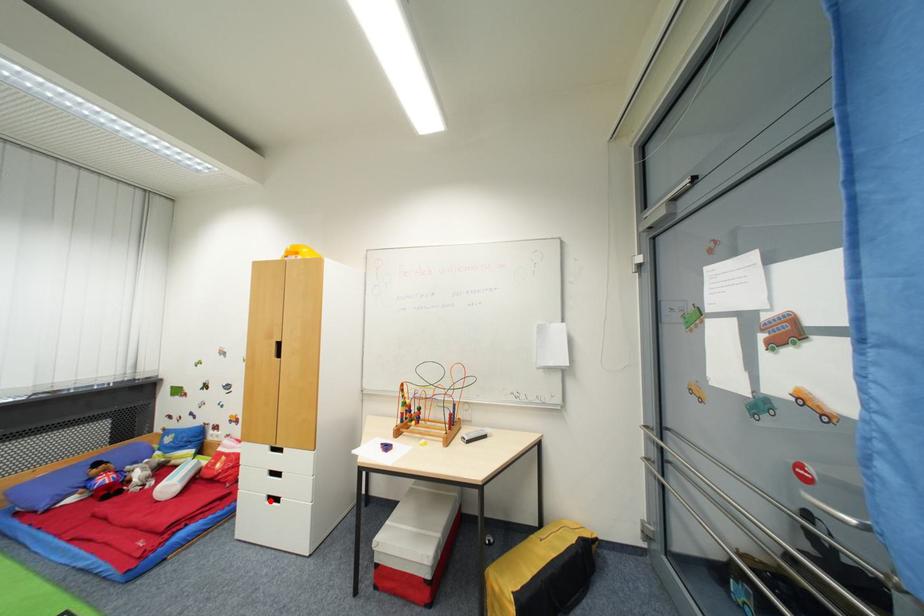
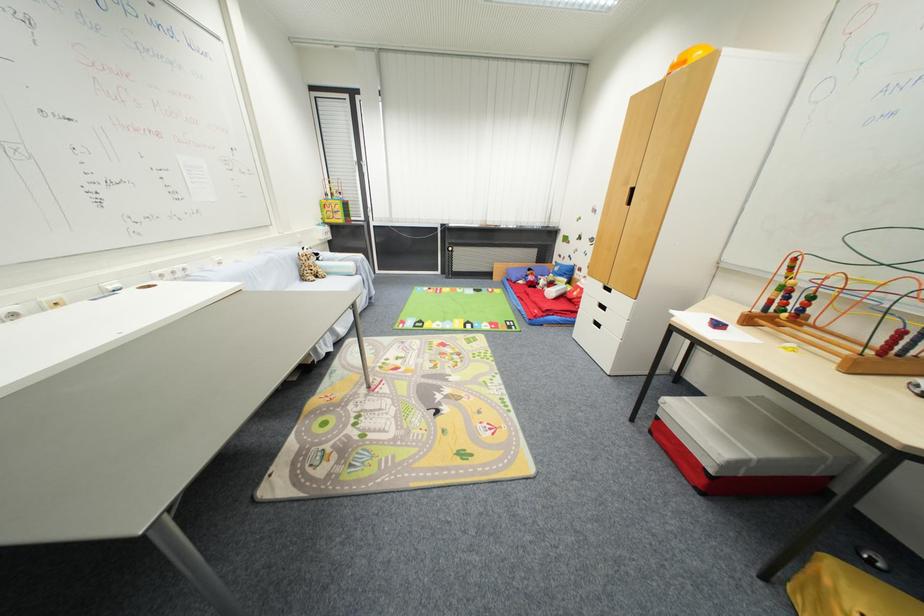
Question: A red point is marked in image1. In image2, is the corresponding 3D point closer to the camera or farther? Reply with the corresponding letter.

Choices:
 (A) The corresponding 3D point is closer.
 (B) The corresponding 3D point is farther.

Answer: (A)